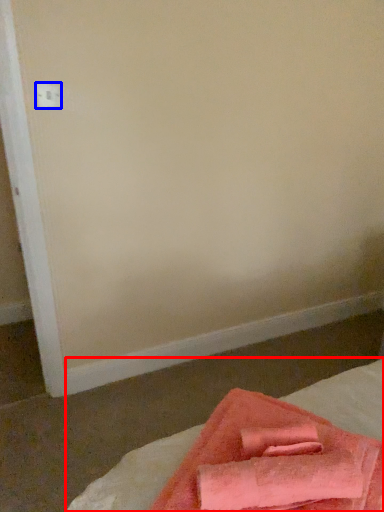
Question: Which of the following is the farthest to the observer, bed (highlighted by a red box) or electric outlet (highlighted by a blue box)?

Choices:
 (A) bed
 (B) electric outlet

Answer: (B)